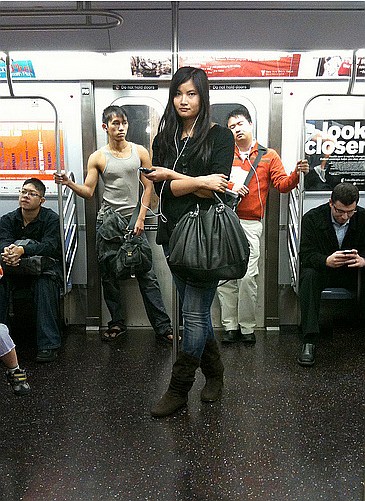
This screenshot has width=365, height=501. In order to click on doors in this screenshot , I will do `click(226, 94)`, `click(138, 95)`.